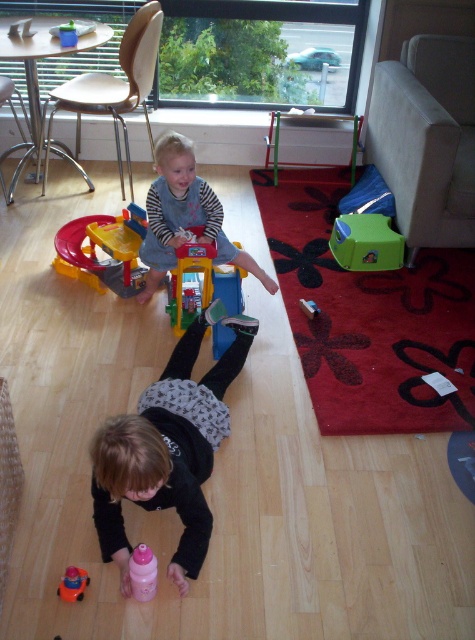
Where is the matte striped shirt at center located in the image?

The matte striped shirt at center is located at point coordinates of (184, 216).

You are a parent in the room and want to hand your child the pink plastic bottle at lower center without disturbing the rubberized plastic toy car at center. Which direction should you move the bottle to ensure it stays away from the toy car?

Move the pink plastic bottle at lower center to the left of the rubberized plastic toy car at center, as it is already positioned to the left and away from the toy car.